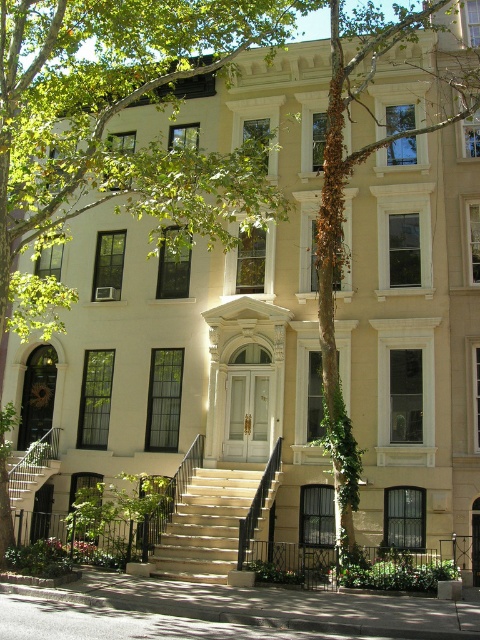
Question: Which object is positioned farthest from the beige stone stairs at center?

Choices:
 (A) metallic silver staircase at lower left
 (B) green leafy tree at center

Answer: (B)

Question: Does green leafy tree at center come in front of metallic silver staircase at lower left?

Choices:
 (A) yes
 (B) no

Answer: (A)

Question: Estimate the real-world distances between objects in this image. Which object is farther from the beige stone stairs at center?

Choices:
 (A) metallic silver staircase at lower left
 (B) green leafy tree at center

Answer: (B)

Question: Considering the relative positions of green leafy tree at center and beige stone stairs at center in the image provided, where is green leafy tree at center located with respect to beige stone stairs at center?

Choices:
 (A) above
 (B) below

Answer: (A)

Question: Can you confirm if green leafy tree at center is positioned above metallic silver staircase at lower left?

Choices:
 (A) no
 (B) yes

Answer: (B)

Question: Estimate the real-world distances between objects in this image. Which object is farther from the beige stone stairs at center?

Choices:
 (A) green leafy tree at center
 (B) metallic silver staircase at lower left

Answer: (A)